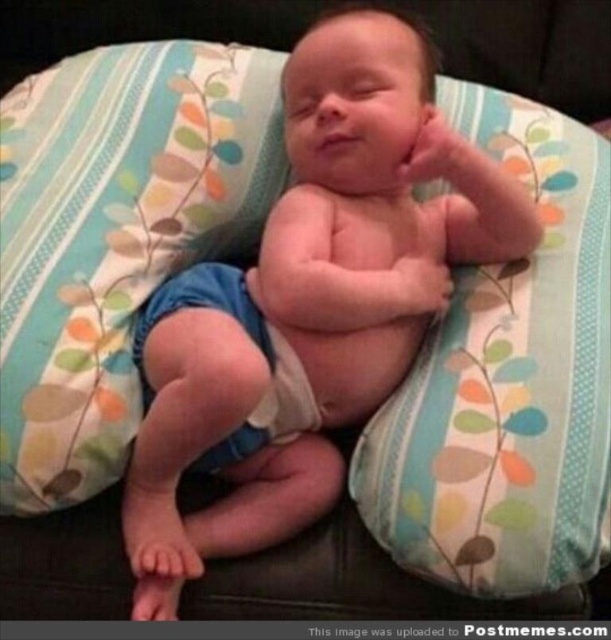
You are a photographer setting up a shoot for a baby product catalog. You need to position the baby so that both the blue fabric pillow at center and the fluffy fabric pillow at center are visible in the frame. Based on their positions, which pillow should be placed closer to the left side of the camera frame?

The blue fabric pillow at center is to the left of the fluffy fabric pillow at center, so the blue fabric pillow at center should be placed closer to the left side of the camera frame.

You are a photographer setting up a shoot for a baby product catalog. You have two pillows, the blue fabric pillow at center and the fluffy fabric pillow at center, placed in the scene. The client wants the baby to be positioned so that their head is elevated slightly. Which pillow should you choose to place under the baby to achieve this?

The fluffy fabric pillow at center should be used because it has a greater height than the blue fabric pillow at center, providing better elevation for the baby.